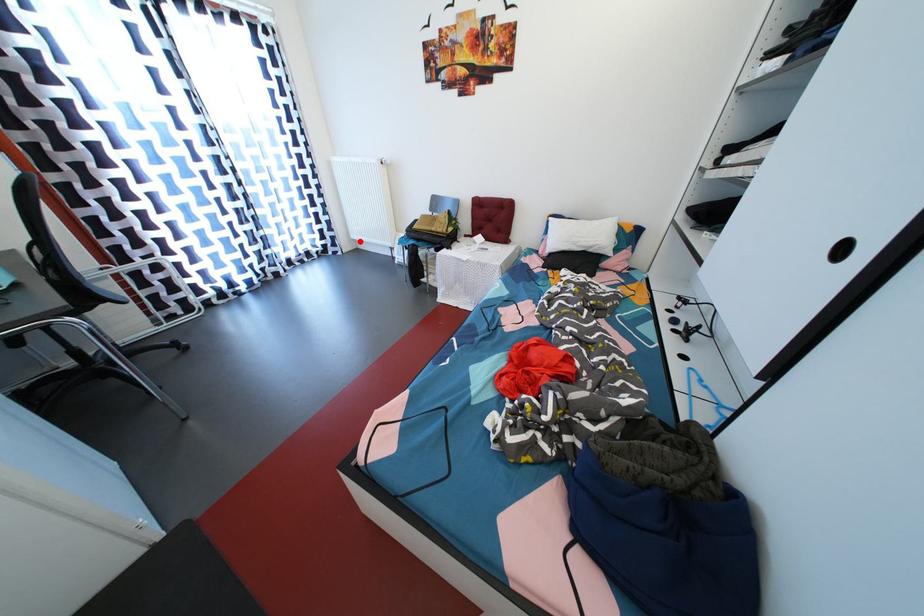
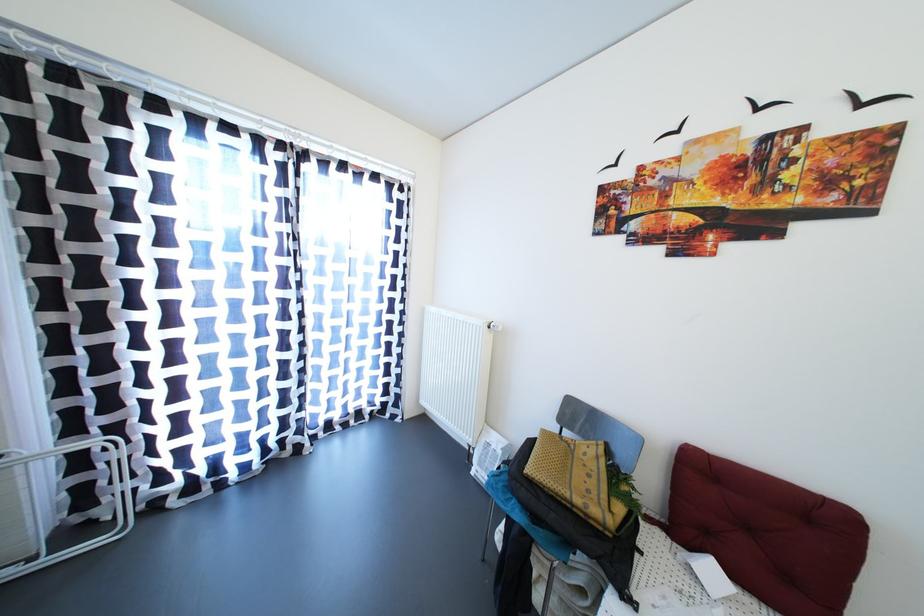
Question: A red point is marked in image1. In image2, is the corresponding 3D point closer to the camera or farther? Reply with the corresponding letter.

Choices:
 (A) The corresponding 3D point is closer.
 (B) The corresponding 3D point is farther.

Answer: (B)